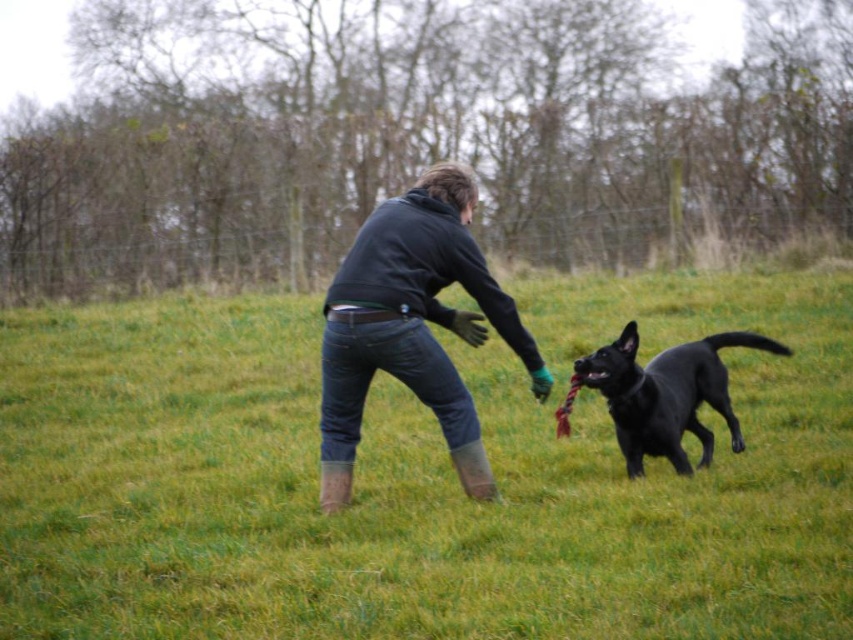
Between point (444, 490) and point (404, 328), which one is positioned in front?

Point (404, 328) is in front.

Looking at this image, can you confirm if green grass at center is smaller than dark gray hoodie at center?

No, green grass at center is not smaller than dark gray hoodie at center.

Which is in front, point (103, 445) or point (355, 381)?

Point (355, 381) is in front.

Where is `green grass at center`? green grass at center is located at coordinates (418, 477).

Based on the photo, can you confirm if dark gray hoodie at center is positioned to the left of black glossy dog at center?

Yes, dark gray hoodie at center is to the left of black glossy dog at center.

You are a GUI agent. You are given a task and a screenshot of the screen. Output one action in this format:
    pyautogui.click(x=<x>, y=<y>)
    Task: Click on the dark gray hoodie at center
    The height and width of the screenshot is (640, 853).
    Given the screenshot: What is the action you would take?
    pyautogui.click(x=412, y=326)

This screenshot has height=640, width=853. What do you see at coordinates (412, 326) in the screenshot?
I see `dark gray hoodie at center` at bounding box center [412, 326].

Where is `dark gray hoodie at center`? The image size is (853, 640). dark gray hoodie at center is located at coordinates (412, 326).

Which is in front, point (22, 467) or point (708, 464)?

Point (708, 464) is more forward.

How much distance is there between green grass at center and black glossy dog at center?

The distance of green grass at center from black glossy dog at center is 1.65 meters.

Find the location of a particular element. The height and width of the screenshot is (640, 853). green grass at center is located at coordinates (418, 477).

This screenshot has width=853, height=640. I want to click on green grass at center, so click(418, 477).